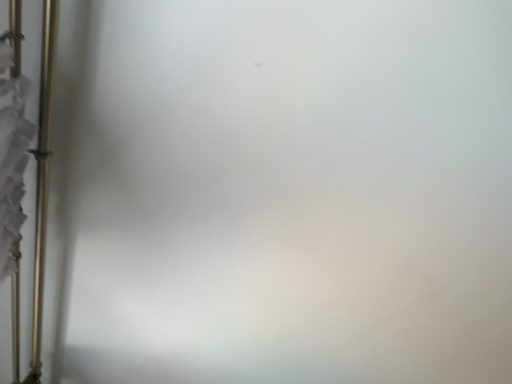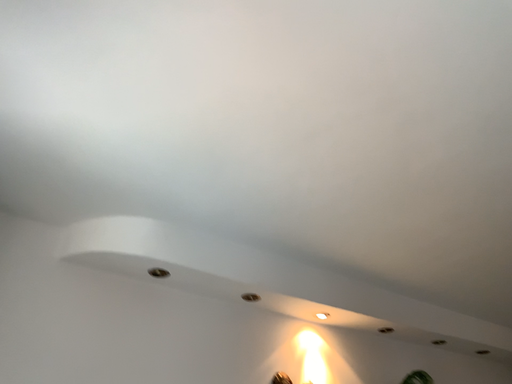
Question: How did the camera likely rotate when shooting the video?

Choices:
 (A) rotated left
 (B) rotated right

Answer: (B)